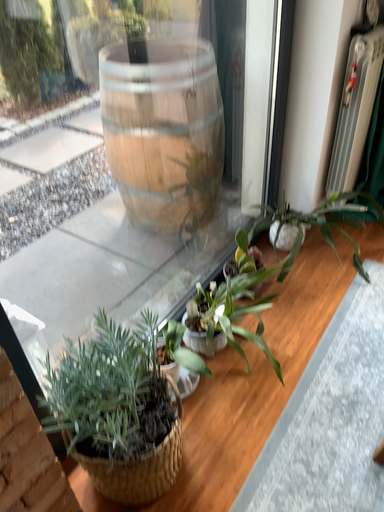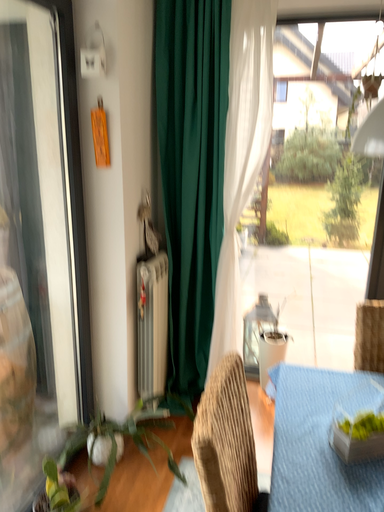
Question: How did the camera likely rotate when shooting the video?

Choices:
 (A) rotated upward
 (B) rotated downward

Answer: (A)